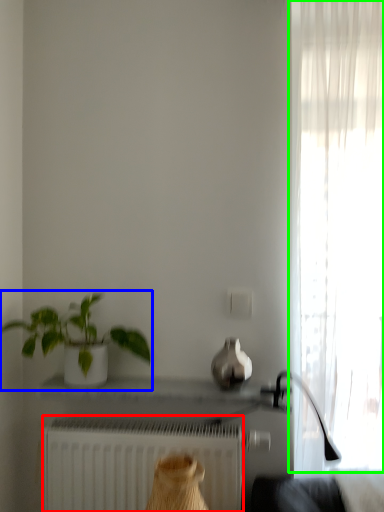
Question: Which object is the closest to the radiator (highlighted by a red box)? Choose among these: houseplant (highlighted by a blue box) or curtain (highlighted by a green box).

Choices:
 (A) houseplant
 (B) curtain

Answer: (A)